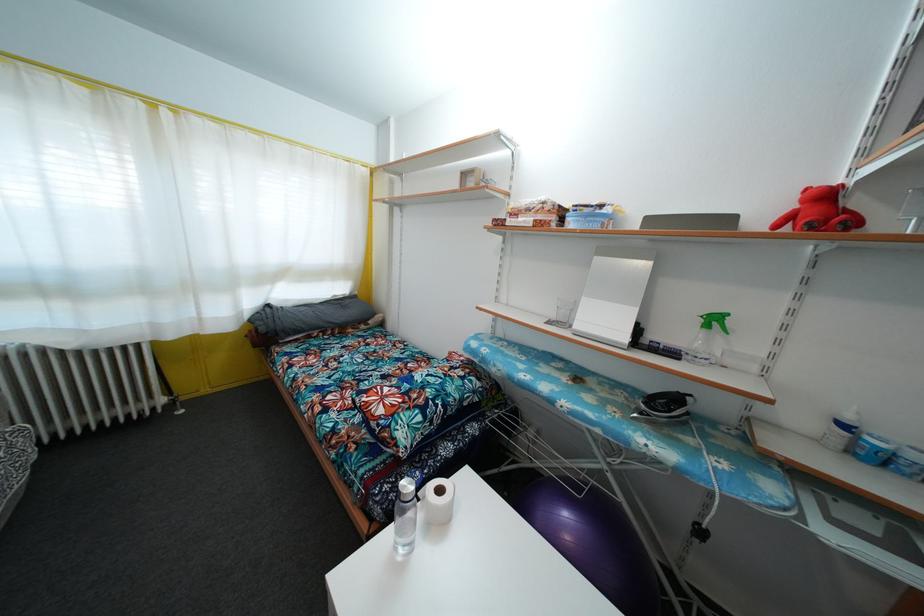
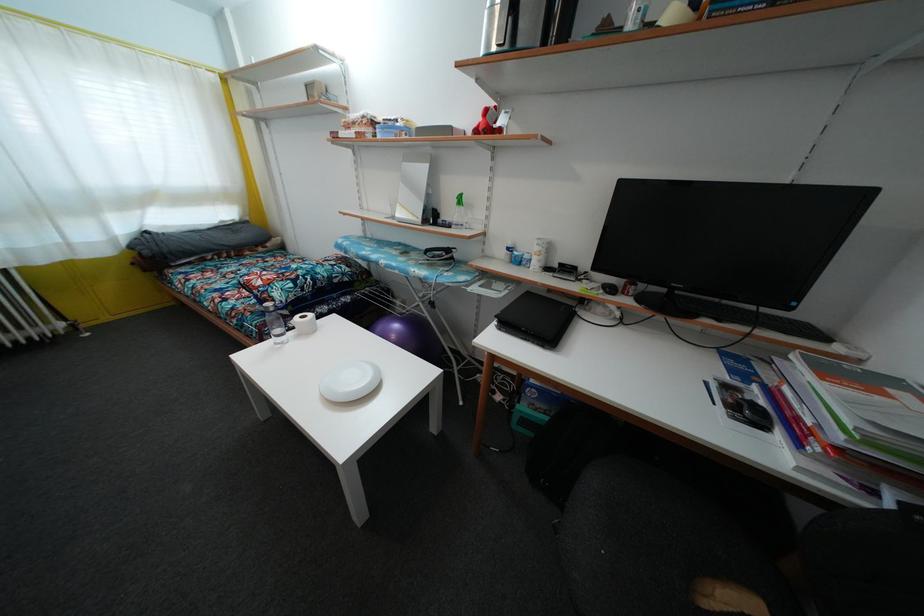
Locate, in the second image, the point that corresponds to the point at 444,498 in the first image.

(307, 323)